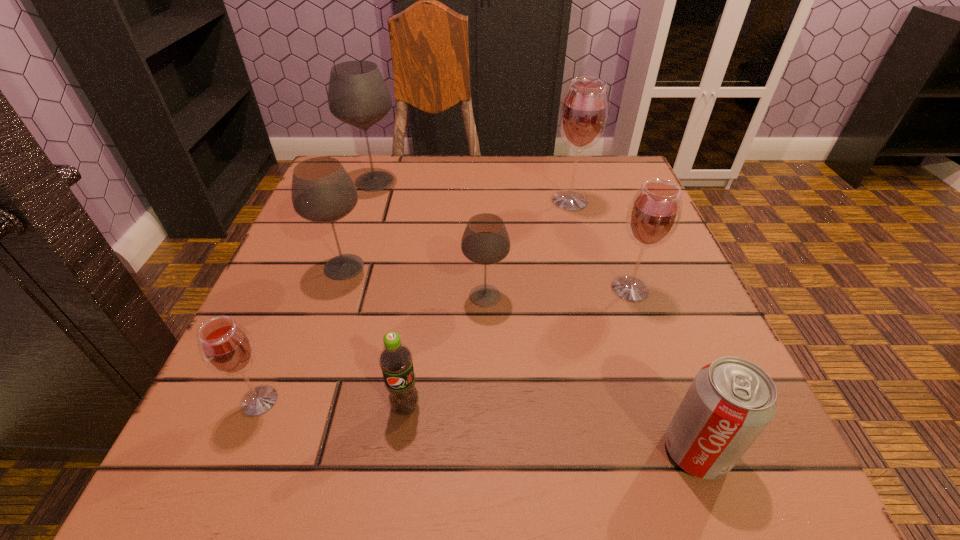
Locate an element on the screen. The image size is (960, 540). gray soda can is located at coordinates (730, 402).

At what (x,y) coordinates should I click in order to perform the action: click on the nearer soda can. Please return your answer as a coordinate pair (x, y). The width and height of the screenshot is (960, 540). Looking at the image, I should click on (730, 402).

Identify the location of vacant space located 0.170m on the front of the farthest gray wineglass. (353, 244).

At what (x,y) coordinates should I click in order to perform the action: click on free space located on the front of the farthest red wineglass. Please return your answer as a coordinate pair (x, y). The width and height of the screenshot is (960, 540). Looking at the image, I should click on (604, 328).

This screenshot has height=540, width=960. In order to click on blank area located on the front of the second smallest gray wineglass in this screenshot , I will do `click(296, 409)`.

The width and height of the screenshot is (960, 540). Identify the location of vacant region located 0.250m on the front of the second biggest red wineglass. (686, 448).

Image resolution: width=960 pixels, height=540 pixels. I want to click on vacant space situated on the left of the rightmost gray wineglass, so click(x=381, y=296).

The height and width of the screenshot is (540, 960). What are the coordinates of `free space located on the right of the nearest wineglass` in the screenshot? It's located at (324, 401).

This screenshot has width=960, height=540. What are the coordinates of `vacant space situated on the front label of the farther soda can` in the screenshot? It's located at (398, 457).

Image resolution: width=960 pixels, height=540 pixels. In order to click on vacant area located on the back of the right soda can in this screenshot , I will do [x=649, y=324].